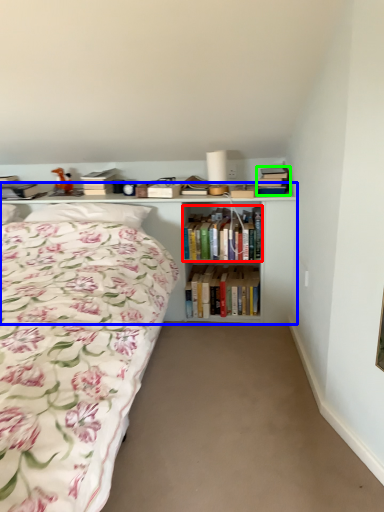
Question: Which object is positioned closest to book (highlighted by a red box)? Select from shelf (highlighted by a blue box) and book (highlighted by a green box).

Choices:
 (A) shelf
 (B) book

Answer: (A)